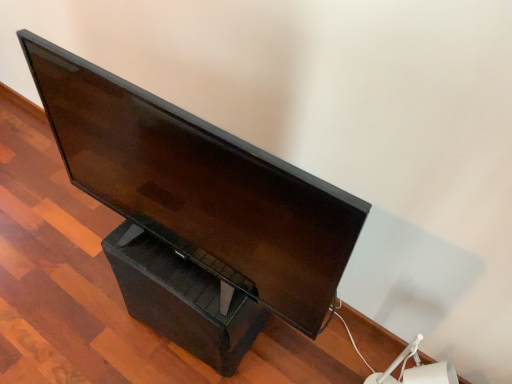
Locate an element on the screen. The image size is (512, 384). matte black monitor at center is located at coordinates (199, 187).

This screenshot has height=384, width=512. What do you see at coordinates (199, 187) in the screenshot? I see `matte black monitor at center` at bounding box center [199, 187].

Where is `black plastic drawer at lower center`? black plastic drawer at lower center is located at coordinates tap(181, 299).

The height and width of the screenshot is (384, 512). What do you see at coordinates (181, 299) in the screenshot?
I see `black plastic drawer at lower center` at bounding box center [181, 299].

The image size is (512, 384). Identify the location of matte black monitor at center. click(x=199, y=187).

Is matte black monitor at center to the left of black plastic drawer at lower center from the viewer's perspective?

No.

Between matte black monitor at center and black plastic drawer at lower center, which one is positioned in front?

matte black monitor at center is closer to the camera.

Is point (195, 262) closer to viewer compared to point (182, 292)?

No, (195, 262) is further to viewer.

From the image's perspective, is matte black monitor at center above or below black plastic drawer at lower center?

From the image's perspective, matte black monitor at center appears above black plastic drawer at lower center.

From a real-world perspective, is matte black monitor at center physically located above or below black plastic drawer at lower center?

From a real-world perspective, matte black monitor at center is physically above black plastic drawer at lower center.

Is matte black monitor at center thinner than black plastic drawer at lower center?

Yes, matte black monitor at center is thinner than black plastic drawer at lower center.

Which of these two, matte black monitor at center or black plastic drawer at lower center, stands shorter?

Standing shorter between the two is black plastic drawer at lower center.

Based on their sizes in the image, would you say matte black monitor at center is bigger or smaller than black plastic drawer at lower center?

In the image, matte black monitor at center appears to be larger than black plastic drawer at lower center.

In the scene shown: Is matte black monitor at center situated inside black plastic drawer at lower center or outside?

matte black monitor at center is not inside black plastic drawer at lower center, it's outside.

Is matte black monitor at center with black plastic drawer at lower center?

No, matte black monitor at center is not with black plastic drawer at lower center.

Is matte black monitor at center oriented towards black plastic drawer at lower center?

No.

How many degrees apart are the facing directions of matte black monitor at center and black plastic drawer at lower center?

The angular difference between matte black monitor at center and black plastic drawer at lower center is 5.4e-05 degrees.

How distant is matte black monitor at center from black plastic drawer at lower center?

25.74 centimeters.

Where is `computer monitor that is above the black plastic drawer at lower center (from a real-world perspective)`? The image size is (512, 384). computer monitor that is above the black plastic drawer at lower center (from a real-world perspective) is located at coordinates (199, 187).

Considering the positions of objects black plastic drawer at lower center and matte black monitor at center in the image provided, who is more to the left, black plastic drawer at lower center or matte black monitor at center?

Positioned to the left is black plastic drawer at lower center.

Based on the photo, relative to matte black monitor at center, is black plastic drawer at lower center in front or behind?

In the image, black plastic drawer at lower center appears behind matte black monitor at center.

Is point (234, 336) closer to viewer compared to point (348, 228)?

No, (234, 336) is further to viewer.

From the image's perspective, is black plastic drawer at lower center below matte black monitor at center?

Indeed, from the image's perspective, black plastic drawer at lower center is shown beneath matte black monitor at center.

From a real-world perspective, relative to matte black monitor at center, is black plastic drawer at lower center vertically above or below?

black plastic drawer at lower center is below matte black monitor at center.

Consider the image. Between black plastic drawer at lower center and matte black monitor at center, which one has smaller width?

matte black monitor at center.

Considering the sizes of objects black plastic drawer at lower center and matte black monitor at center in the image provided, who is shorter, black plastic drawer at lower center or matte black monitor at center?

black plastic drawer at lower center is shorter.

Consider the image. Considering the relative sizes of black plastic drawer at lower center and matte black monitor at center in the image provided, is black plastic drawer at lower center bigger than matte black monitor at center?

No, black plastic drawer at lower center is not bigger than matte black monitor at center.

Is black plastic drawer at lower center positioned beyond the bounds of matte black monitor at center?

black plastic drawer at lower center is positioned outside matte black monitor at center.

Is black plastic drawer at lower center touching matte black monitor at center?

No, black plastic drawer at lower center is not touching matte black monitor at center.

Could you tell me if black plastic drawer at lower center is facing matte black monitor at center?

No, black plastic drawer at lower center is not turned towards matte black monitor at center.

How different are the orientations of black plastic drawer at lower center and matte black monitor at center in degrees?

The angle between the facing direction of black plastic drawer at lower center and the facing direction of matte black monitor at center is 5.4e-05 degrees.

Measure the distance between black plastic drawer at lower center and matte black monitor at center.

black plastic drawer at lower center is 10.13 inches away from matte black monitor at center.

The image size is (512, 384). In order to click on drawer that appears below the matte black monitor at center (from the image's perspective) in this screenshot , I will do `click(181, 299)`.

The height and width of the screenshot is (384, 512). What are the coordinates of `drawer that is below the matte black monitor at center (from the image's perspective)` in the screenshot? It's located at (181, 299).

Identify the location of computer monitor to the right of black plastic drawer at lower center. The width and height of the screenshot is (512, 384). coord(199,187).